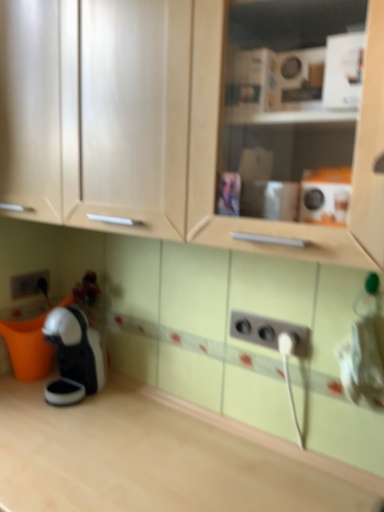
Where is `vacant space to the left of black plastic coffee machine at lower left`? This screenshot has height=512, width=384. vacant space to the left of black plastic coffee machine at lower left is located at coordinates (24, 399).